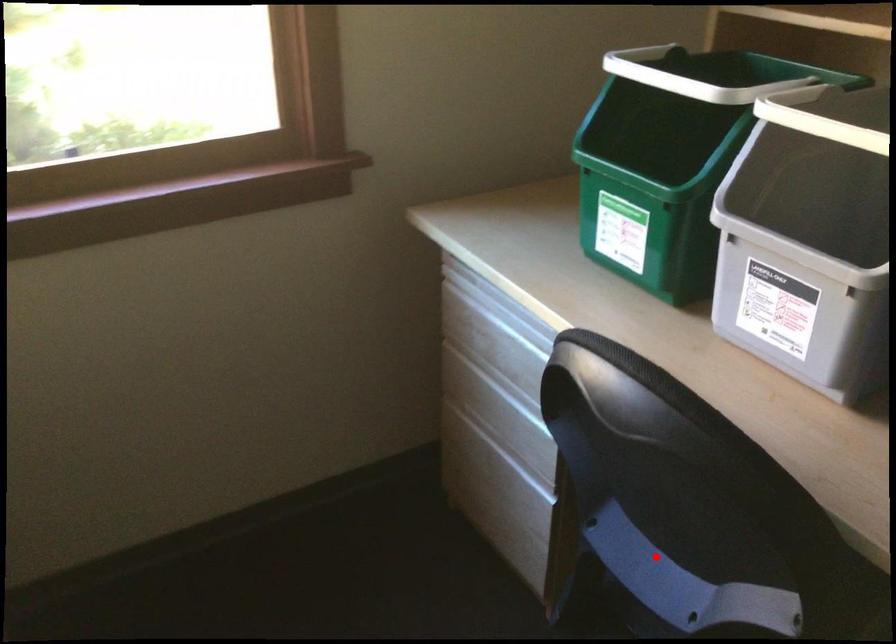
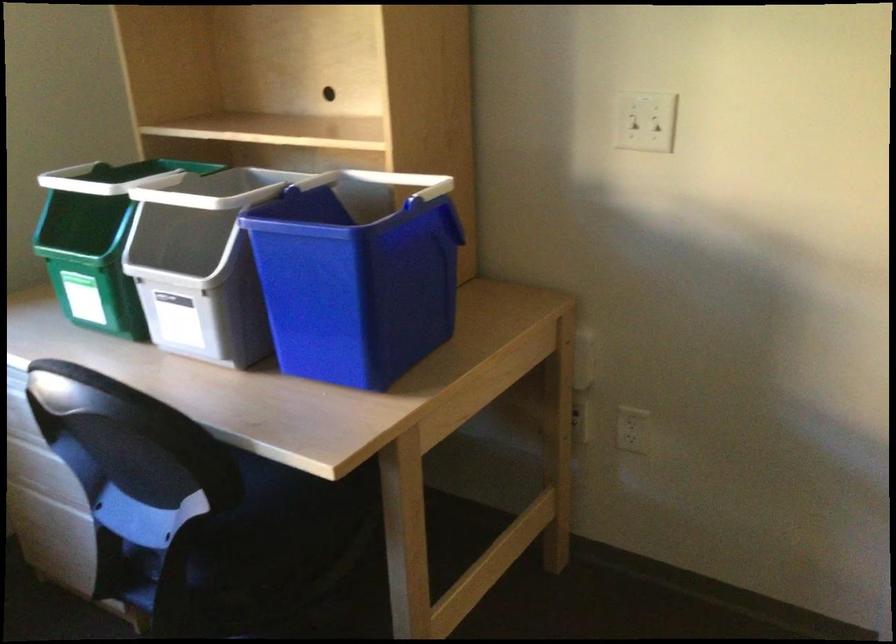
Locate, in the second image, the point that corresponds to the highlighted location in the first image.

(151, 518)